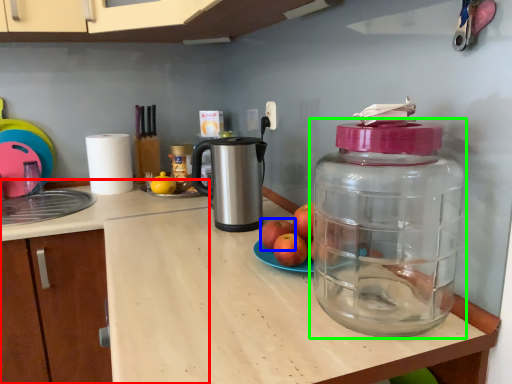
Question: Considering the real-world distances, which object is farthest from counter top (highlighted by a red box)? apple (highlighted by a blue box) or bottle (highlighted by a green box)?

Choices:
 (A) apple
 (B) bottle

Answer: (B)